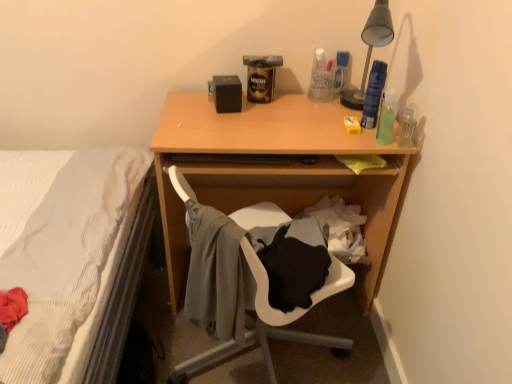
Identify the location of free space behind translucent green bottle at right, arranged as the fourth bottle when viewed from the back. (369, 116).